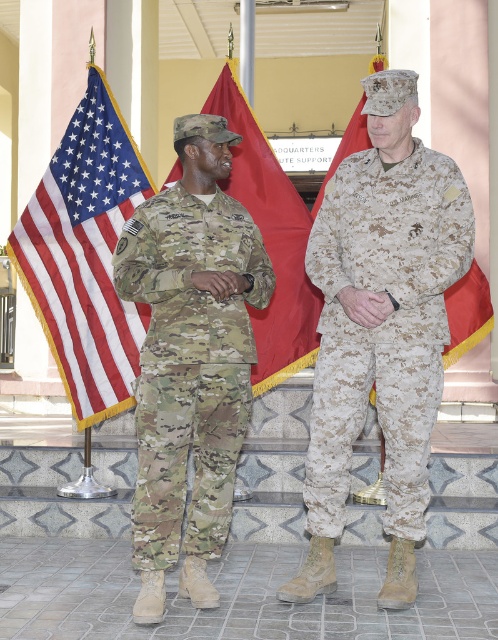
You are a photographer positioned at the bottom of the steps in front of the building. You want to take a photo that includes both the digital camouflage uniform at center and the matte fabric flag at left. Which object should you adjust your camera angle to capture first if you want to include both in the frame?

The digital camouflage uniform at center is located below the matte fabric flag at left. To include both in the frame, you should first adjust your camera angle to capture the matte fabric flag at left, which is higher up, and then ensure the digital camouflage uniform at center is visible below it.